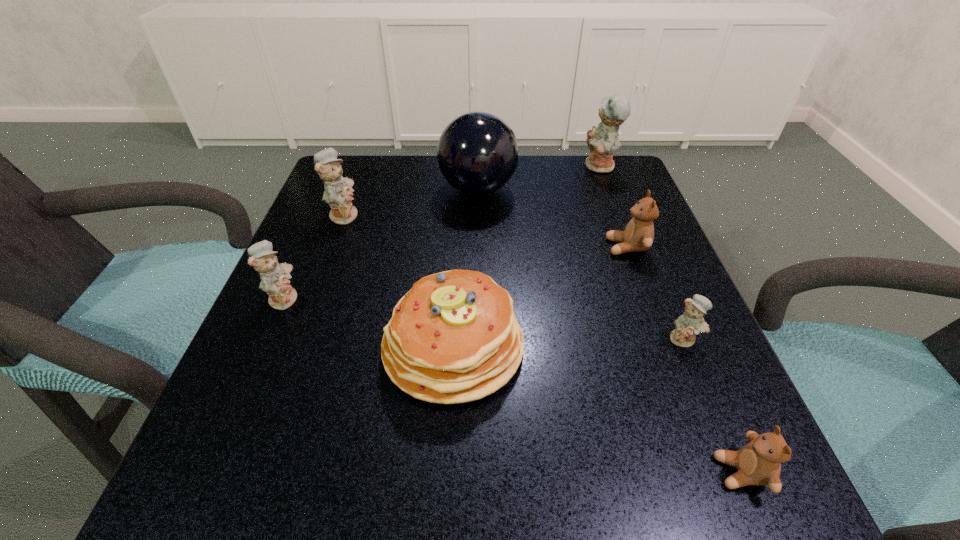
Locate an element on the screen. This screenshot has height=540, width=960. free space between the pancake and the third farthest blue teddy bear is located at coordinates (369, 322).

This screenshot has height=540, width=960. Find the location of `free space between the bowling ball and the smallest blue teddy bear`. free space between the bowling ball and the smallest blue teddy bear is located at coordinates (581, 264).

Identify the location of vacant point located between the fourth nearest teddy bear and the tallest teddy bear. The height and width of the screenshot is (540, 960). (613, 207).

Locate an element on the screen. free space between the nearest object and the third farthest teddy bear is located at coordinates (684, 359).

Find the location of a particular element. blank region between the smaller brown teddy bear and the black bowling ball is located at coordinates (610, 330).

At what (x,y) coordinates should I click in order to perform the action: click on unoccupied area between the black bowling ball and the tallest teddy bear. Please return your answer as a coordinate pair (x, y). The image size is (960, 540). Looking at the image, I should click on (539, 178).

You are a GUI agent. You are given a task and a screenshot of the screen. Output one action in this format:
    pyautogui.click(x=<x>, y=<y>)
    Task: Click on the vacant area that lies between the biggest blue teddy bear and the bowling ball
    The height and width of the screenshot is (540, 960).
    Given the screenshot: What is the action you would take?
    pyautogui.click(x=539, y=178)

Image resolution: width=960 pixels, height=540 pixels. Identify the location of free space between the fourth farthest object and the nearer brown teddy bear. (684, 359).

What are the coordinates of `empty location between the farther brown teddy bear and the smaller brown teddy bear` in the screenshot? It's located at (684, 359).

The image size is (960, 540). In order to click on free point between the bigger brown teddy bear and the bowling ball in this screenshot , I will do `click(552, 218)`.